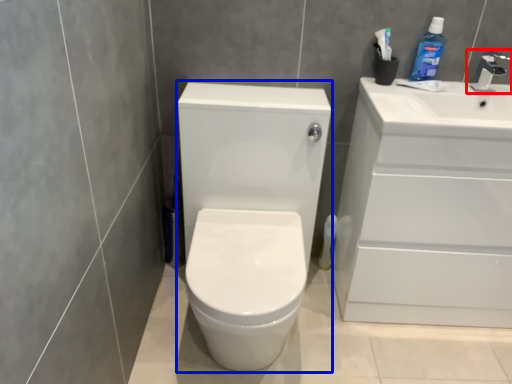
Question: Which object is further to the camera taking this photo, tap (highlighted by a red box) or porcelain (highlighted by a blue box)?

Choices:
 (A) tap
 (B) porcelain

Answer: (A)